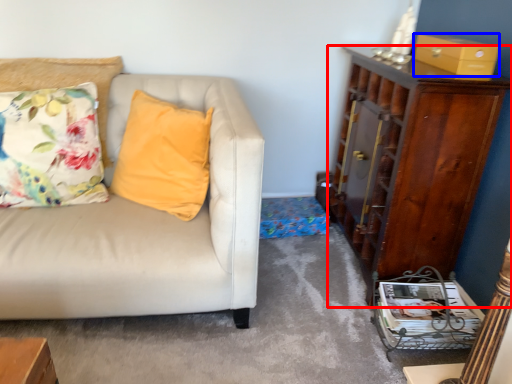
Question: Which object appears closest to the camera in this image, cabinetry (highlighted by a red box) or box (highlighted by a blue box)?

Choices:
 (A) cabinetry
 (B) box

Answer: (A)